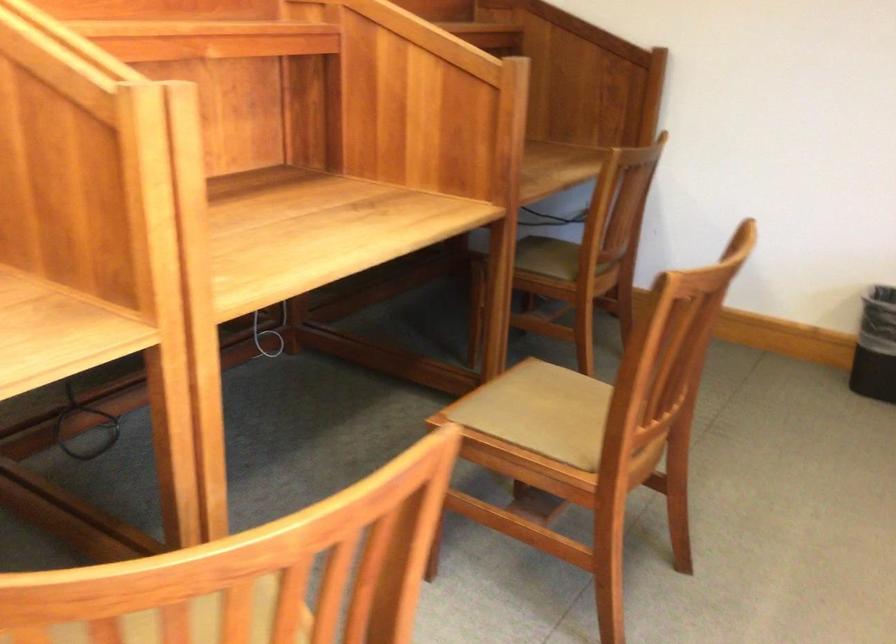
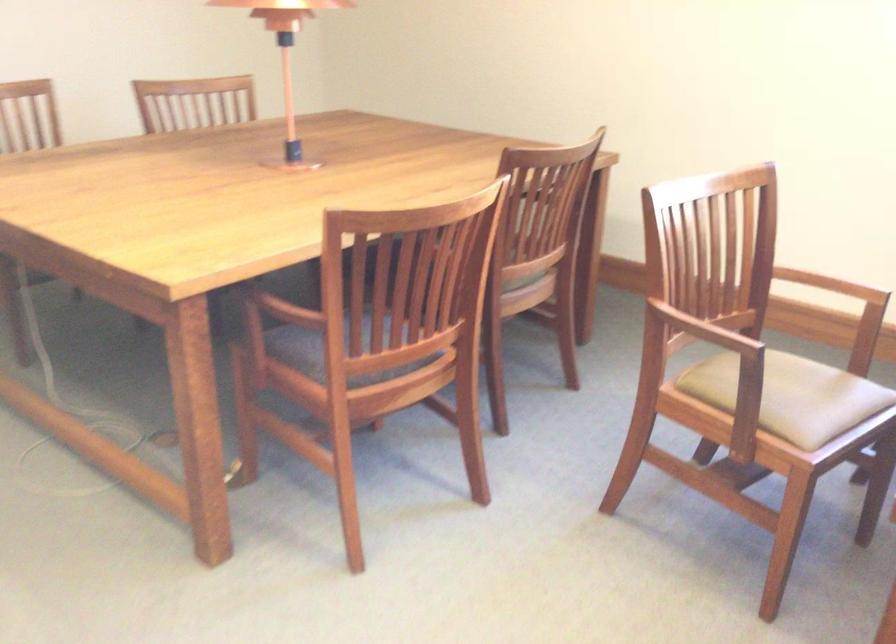
How did the camera likely rotate?

The camera's rotation is toward right-down.